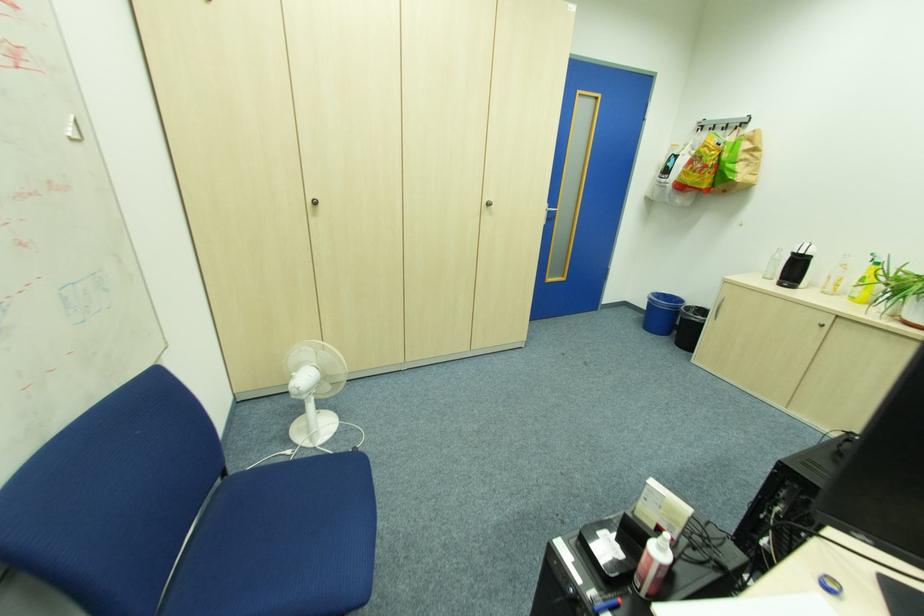
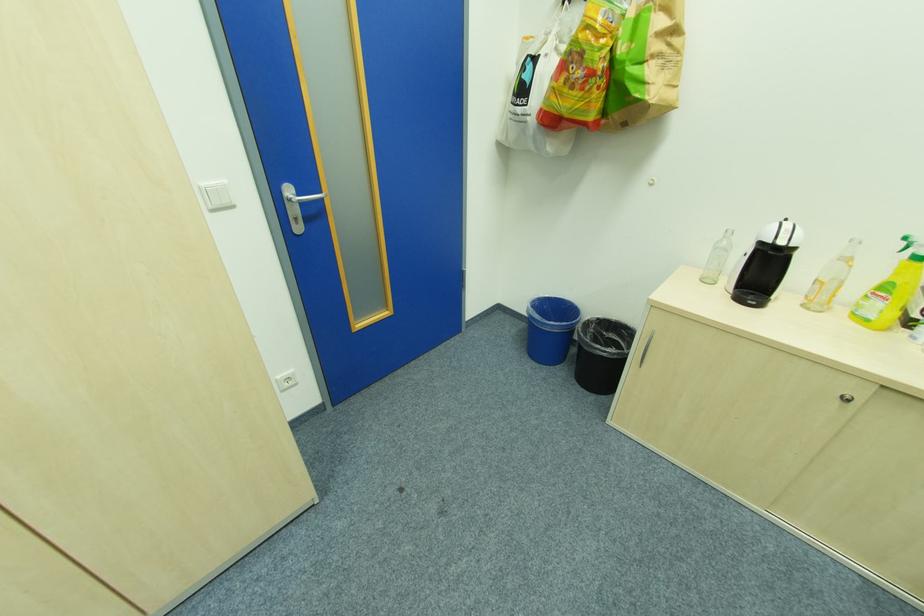
Where in the second image is the point corresponding to (x=695, y=308) from the first image?

(592, 322)